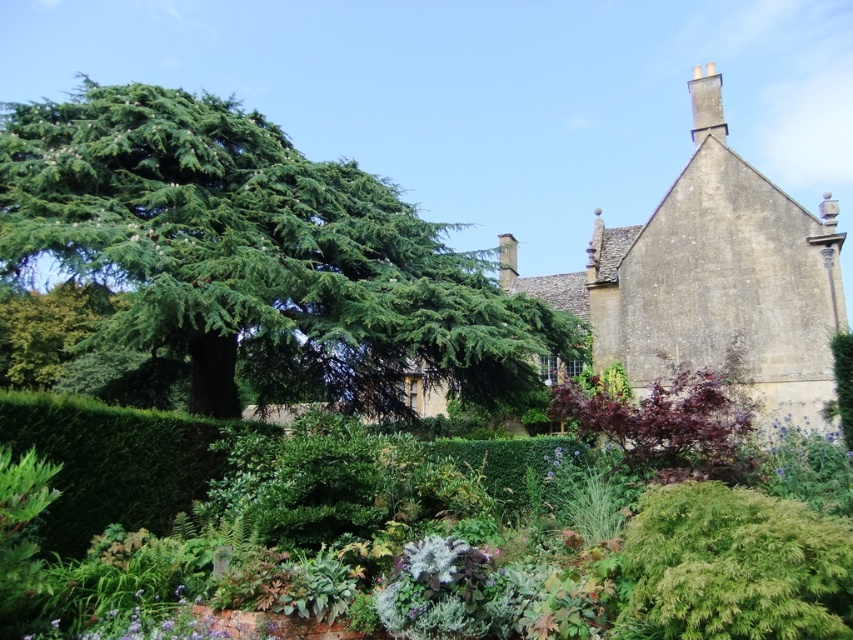
Does green leafy tree at upper left come in front of silvery-gray fluffy plant at center?

No, it is not.

Does green leafy tree at upper left have a lesser width compared to silvery-gray fluffy plant at center?

In fact, green leafy tree at upper left might be wider than silvery-gray fluffy plant at center.

Where is `green leafy tree at upper left`? This screenshot has height=640, width=853. green leafy tree at upper left is located at coordinates (258, 256).